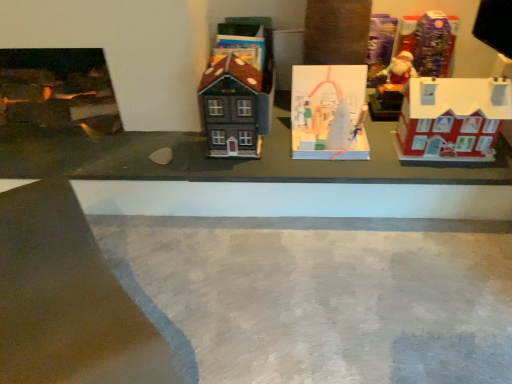
Image resolution: width=512 pixels, height=384 pixels. I want to click on vacant region to the right of matte brown house at center, positioned as the first toy in left-to-right order, so click(x=279, y=150).